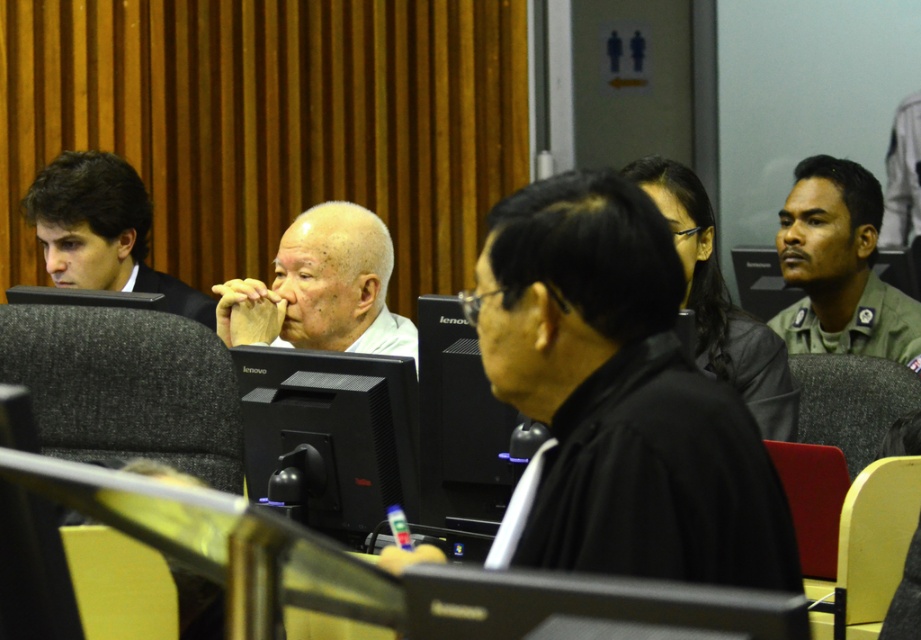
You are a photographer in the courtroom. You need to capture a photo of both the black matte robe at center and the green uniform at right. Based on their positions, which one should you focus on first to ensure both are in the frame?

The black matte robe at center is located below the green uniform at right, so you should focus on the green uniform at right first to ensure both are in the frame.

You are a photographer in the courtroom and need to capture both the black matte robe at center and the green uniform at right in a single photo. Which subject should you focus on to ensure both are in frame without zooming in or out?

You should focus on the black matte robe at center because it is smaller in size compared to the green uniform at right, so keeping it centered will allow the larger green uniform at right to fit within the frame as well.

Consider the image. In the courtroom scene, you need to determine the relative widths of two features. You see a black matte robe at center and a dark brown hair at left. Which one is narrower?

The black matte robe at center has a lesser width compared to dark brown hair at left, so the black matte robe at center is narrower.